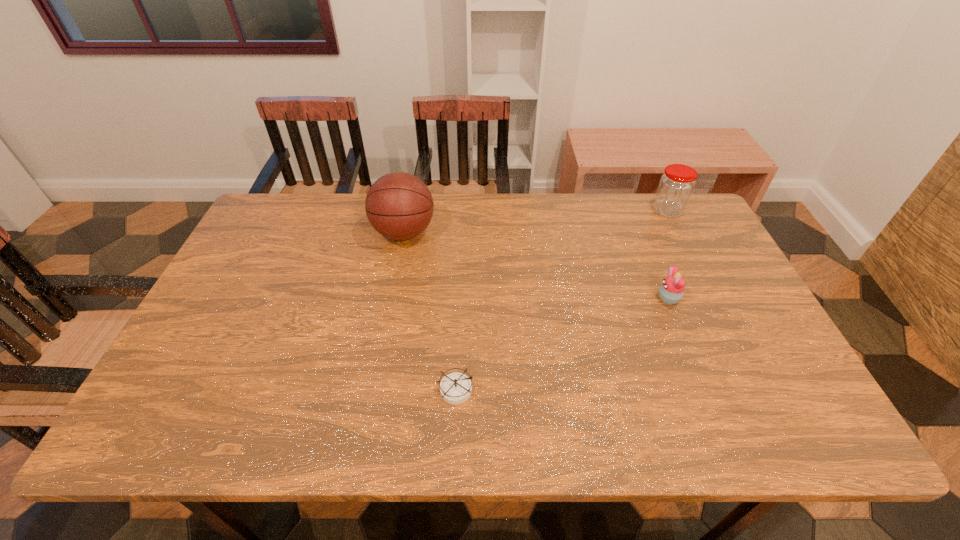
The height and width of the screenshot is (540, 960). I want to click on blank area at the near edge, so click(551, 443).

The height and width of the screenshot is (540, 960). In order to click on free space at the right edge of the desktop in this screenshot , I will do `click(731, 363)`.

Locate an element on the screen. vacant area at the far left corner is located at coordinates (264, 214).

The width and height of the screenshot is (960, 540). I want to click on empty location between the tallest object and the rightmost object, so click(x=536, y=222).

Where is `vacant space in between the rightmost object and the tallest object`? This screenshot has width=960, height=540. vacant space in between the rightmost object and the tallest object is located at coordinates (x=536, y=222).

The width and height of the screenshot is (960, 540). In order to click on vacant space that is in between the tallest object and the third shortest object in this screenshot , I will do `click(536, 222)`.

Where is `free point between the cupcake and the rightmost object`? The width and height of the screenshot is (960, 540). free point between the cupcake and the rightmost object is located at coordinates (667, 254).

Locate an element on the screen. unoccupied area between the rightmost object and the third tallest object is located at coordinates (667, 254).

The height and width of the screenshot is (540, 960). What are the coordinates of `vacant area that lies between the second object from right to left and the rightmost object` in the screenshot? It's located at (667, 254).

You are a GUI agent. You are given a task and a screenshot of the screen. Output one action in this format:
    pyautogui.click(x=<x>, y=<y>)
    Task: Click on the vacant region between the rightmost object and the third object from left to right
    The image size is (960, 540).
    Given the screenshot: What is the action you would take?
    pyautogui.click(x=667, y=254)